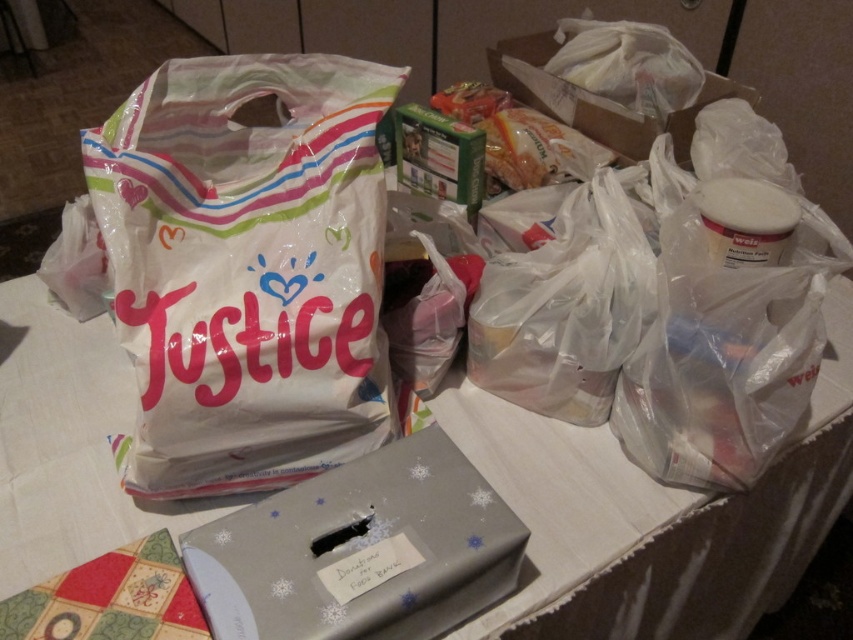
Question: Is white plastic bag at left smaller than silver paper box at lower center?

Choices:
 (A) no
 (B) yes

Answer: (A)

Question: Considering the relative positions of white paper bag at upper left and silver paper box at lower center in the image provided, where is white paper bag at upper left located with respect to silver paper box at lower center?

Choices:
 (A) left
 (B) right

Answer: (B)

Question: Among these points, which one is nearest to the camera?

Choices:
 (A) (747, 92)
 (B) (370, 273)
 (C) (657, 497)

Answer: (B)

Question: Based on their relative distances, which object is nearer to the white paper bag at upper left?

Choices:
 (A) translucent plastic bag at upper right
 (B) white plastic bag at left
 (C) silver paper box at lower center

Answer: (C)

Question: Which object is positioned farthest from the white paper bag at upper left?

Choices:
 (A) translucent plastic bag at upper right
 (B) white plastic bag at left

Answer: (A)

Question: Does white paper bag at upper left have a smaller size compared to silver paper box at lower center?

Choices:
 (A) yes
 (B) no

Answer: (B)